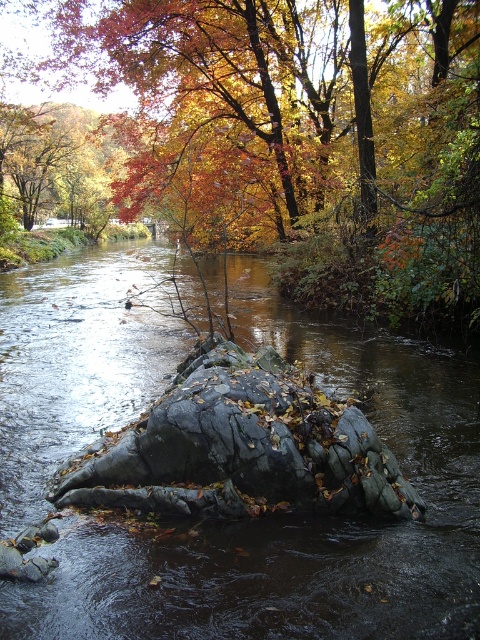
You are an artist trying to paint the autumn scene. You notice the autumn leaves at center and the rough gray rock at center. Which object is wider in the image?

The autumn leaves at center is wider than the rough gray rock at center.

You are a hiker trying to cross the stream. You see the autumn leaves at center and the rough gray rock at center. Which object is taller and can provide better footing?

The autumn leaves at center is much taller than the rough gray rock at center, so it can provide better footing for crossing the stream.

You are a hiker trying to cross the stream in the autumn scene. You see the black rock at center and the rough gray rock at center. Which rock is on top of the other?

The black rock at center is positioned over the rough gray rock at center, so the black rock is on top of the rough gray rock.